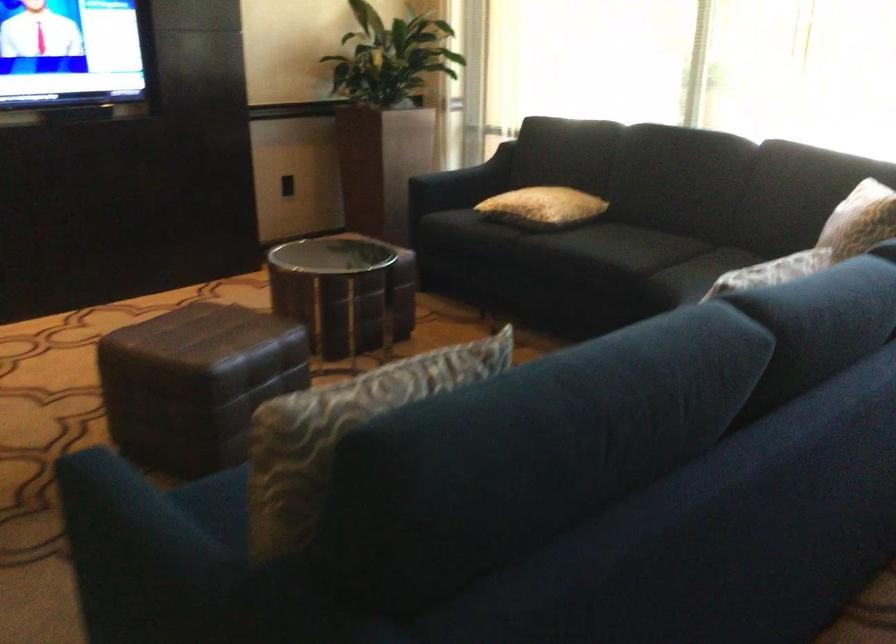
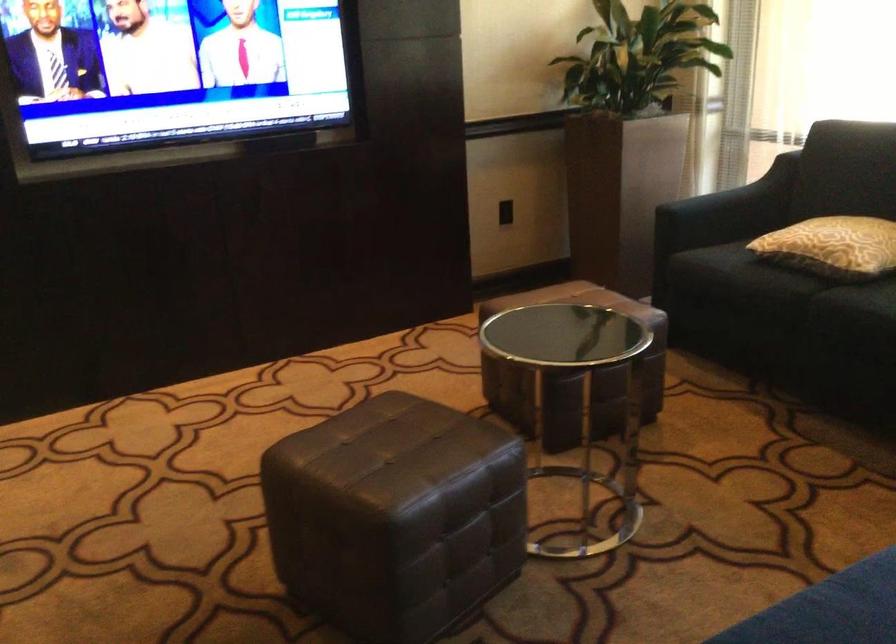
Locate, in the second image, the point that corresponds to point (218, 368) in the first image.

(394, 516)